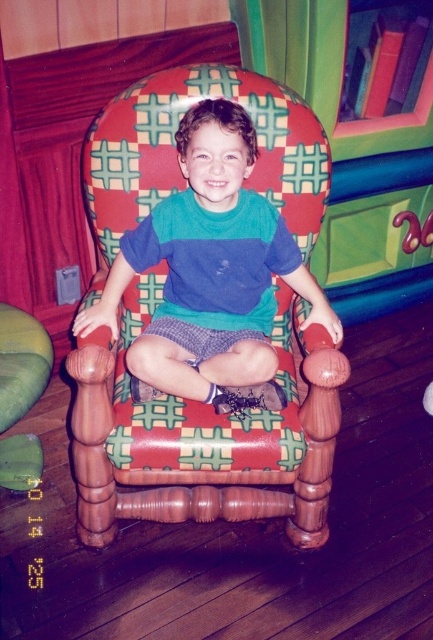
You are a photographer setting up a shoot in this room. You need to ensure that the matte green shirt at center and the green fabric rocking chair at lower left are both visible in the frame. Given their sizes, which object should you prioritize positioning closer to the camera to maintain their visibility?

The matte green shirt at center is much taller than the green fabric rocking chair at lower left. To ensure both are visible, prioritize positioning the green fabric rocking chair at lower left closer to the camera since it is smaller and might be less noticeable from a distance.